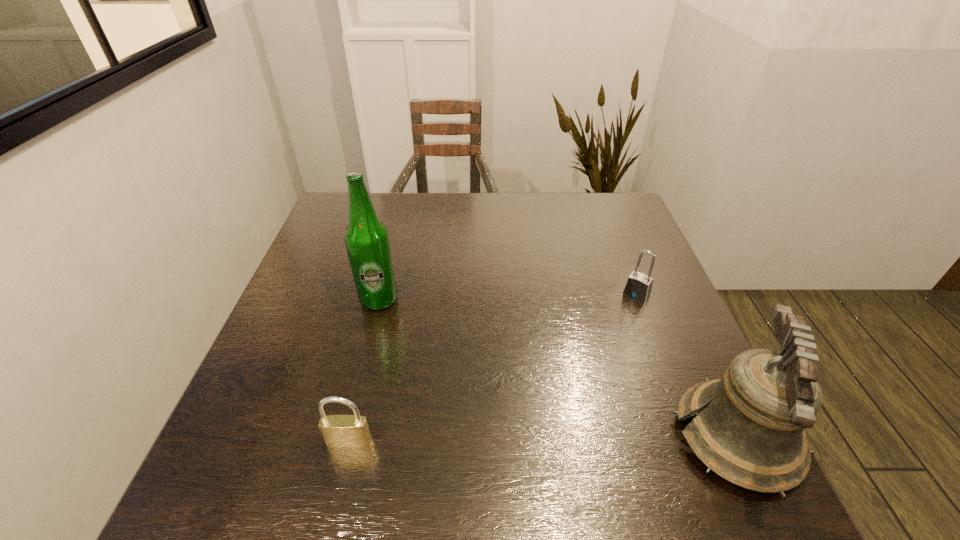
The width and height of the screenshot is (960, 540). What are the coordinates of `blank area located on the label of the beer bottle` in the screenshot? It's located at (427, 340).

The width and height of the screenshot is (960, 540). Identify the location of padlock at the near edge. (344, 431).

I want to click on bell positioned at the near edge, so click(x=750, y=429).

Image resolution: width=960 pixels, height=540 pixels. What are the coordinates of `bell that is at the right edge` in the screenshot? It's located at (750, 429).

The image size is (960, 540). I want to click on padlock that is at the right edge, so click(x=638, y=286).

Where is `object located at the near right corner`? This screenshot has width=960, height=540. object located at the near right corner is located at coordinates (750, 429).

In the image, there is a desktop. Where is `vacant space at the far edge`? vacant space at the far edge is located at coordinates (456, 212).

The image size is (960, 540). Identify the location of vacant region at the near edge of the desktop. (570, 435).

The image size is (960, 540). Find the location of `vacant area at the left edge`. vacant area at the left edge is located at coordinates (330, 337).

In the image, there is a desktop. Where is `free space at the right edge`? This screenshot has height=540, width=960. free space at the right edge is located at coordinates (622, 321).